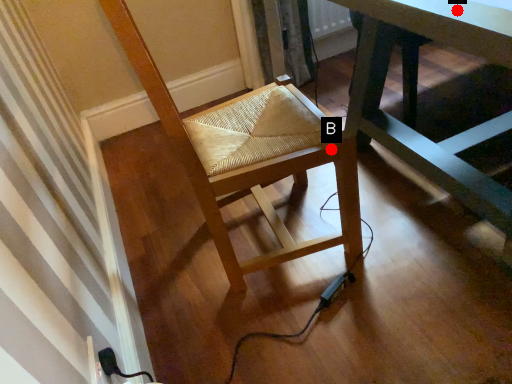
Question: Two points are circled on the image, labeled by A and B beside each circle. Which point is farther to the camera?

Choices:
 (A) A is further
 (B) B is further

Answer: (B)